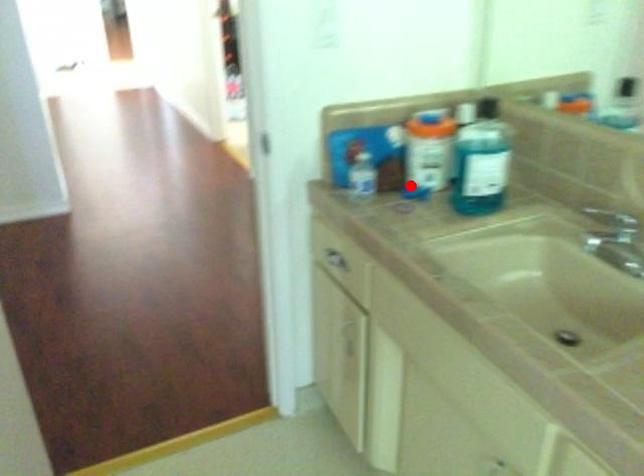
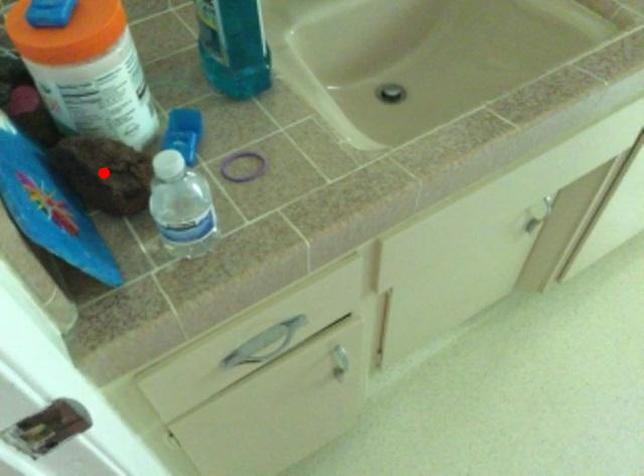
I am providing you with two images of the same scene from different viewpoints. A red point is marked on the first image and another point is marked on the second image. Are the points marked in image1 and image2 representing the same 3D position?

Yes